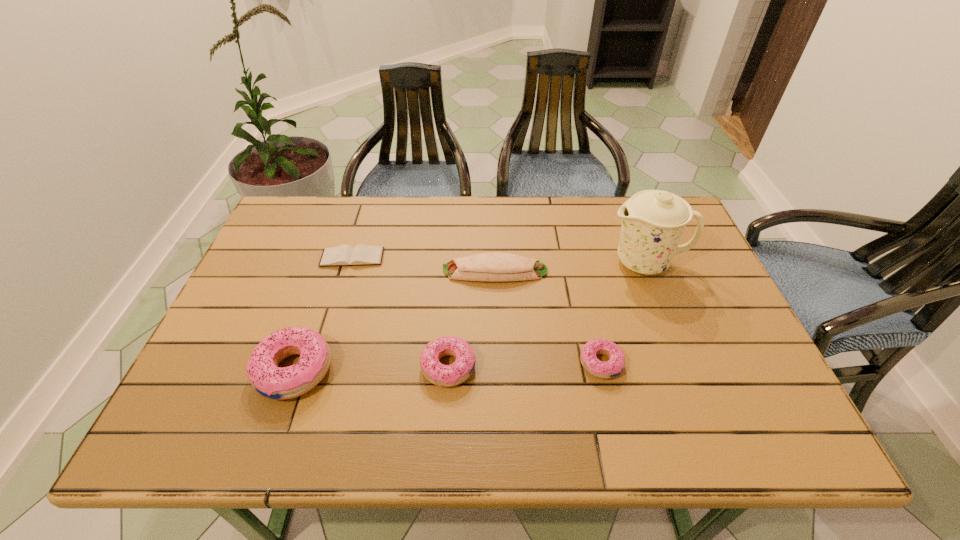
Locate an element on the screen. free spot located on the right of the tallest doughnut is located at coordinates (435, 370).

You are a GUI agent. You are given a task and a screenshot of the screen. Output one action in this format:
    pyautogui.click(x=<x>, y=<y>)
    Task: Click on the free region located on the right of the second shortest doughnut
    This screenshot has height=540, width=960.
    Given the screenshot: What is the action you would take?
    pyautogui.click(x=577, y=367)

In order to click on free space located on the back of the fifth object from left to right in this screenshot , I will do `click(581, 277)`.

Identify the location of vacant space located 0.230m at the bitten end of the burrito. This screenshot has width=960, height=540. (359, 271).

The height and width of the screenshot is (540, 960). Find the location of `vacant area situated 0.070m at the bitten end of the burrito`. vacant area situated 0.070m at the bitten end of the burrito is located at coordinates (417, 271).

Find the location of a particular element. This screenshot has width=960, height=540. vacant point located at the bitten end of the burrito is located at coordinates (410, 271).

Where is `vacant space located 0.190m on the back of the shortest object`? The image size is (960, 540). vacant space located 0.190m on the back of the shortest object is located at coordinates (367, 210).

You are a GUI agent. You are given a task and a screenshot of the screen. Output one action in this format:
    pyautogui.click(x=<x>, y=<y>)
    Task: Click on the vacant space located on the spout of the tallest object
    The height and width of the screenshot is (540, 960).
    Given the screenshot: What is the action you would take?
    pyautogui.click(x=573, y=262)

Find the location of a particular element. This screenshot has width=960, height=540. free space located 0.380m on the spout of the tallest object is located at coordinates (470, 262).

Image resolution: width=960 pixels, height=540 pixels. I want to click on vacant region located on the spout of the tallest object, so click(x=488, y=262).